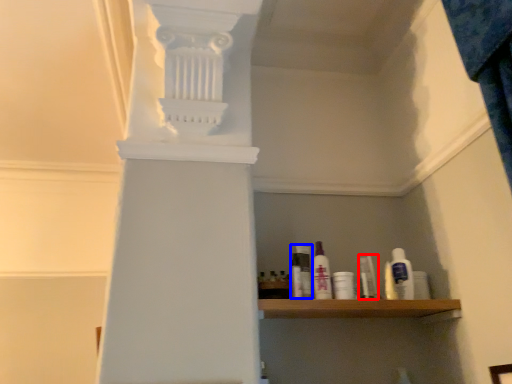
Question: Which object is further to the camera taking this photo, toiletry (highlighted by a red box) or mouthwash (highlighted by a blue box)?

Choices:
 (A) toiletry
 (B) mouthwash

Answer: (A)